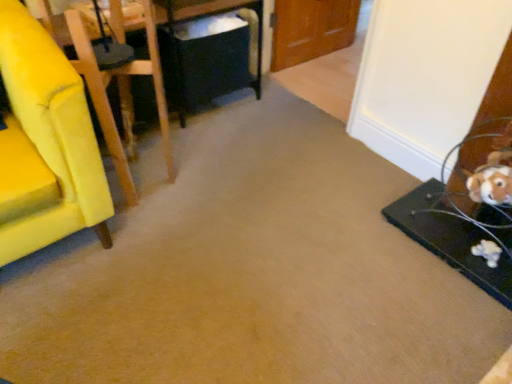
Question: From the image's perspective, would you say black plastic table at center, arranged as the first table when viewed from the back, is positioned over black matte table at right, the first table positioned from the bottom?

Choices:
 (A) yes
 (B) no

Answer: (A)

Question: Can you confirm if black plastic table at center, the second table when ordered from right to left, is bigger than black matte table at right, placed as the 2th table when sorted from left to right?

Choices:
 (A) yes
 (B) no

Answer: (A)

Question: Does black plastic table at center, which appears as the 1th table when viewed from the left, have a greater height compared to black matte table at right, arranged as the second table when viewed from the top?

Choices:
 (A) no
 (B) yes

Answer: (B)

Question: From a real-world perspective, is black plastic table at center, which ranks as the first table in top-to-bottom order, below black matte table at right, arranged as the second table when viewed from the top?

Choices:
 (A) yes
 (B) no

Answer: (B)

Question: From the image's perspective, is black plastic table at center, arranged as the first table when viewed from the back, located beneath black matte table at right, the first table positioned from the bottom?

Choices:
 (A) yes
 (B) no

Answer: (B)

Question: Considering the positions of point (101, 109) and point (473, 243), is point (101, 109) closer or farther from the camera than point (473, 243)?

Choices:
 (A) closer
 (B) farther

Answer: (A)

Question: In the image, is yellow fabric chair at left on the left side or the right side of black matte table at right, arranged as the second table when viewed from the top?

Choices:
 (A) right
 (B) left

Answer: (B)

Question: From the image's perspective, is yellow fabric chair at left located above or below black matte table at right, placed as the 2th table when sorted from left to right?

Choices:
 (A) below
 (B) above

Answer: (B)

Question: Is yellow fabric chair at left inside or outside of black matte table at right, arranged as the second table when viewed from the top?

Choices:
 (A) outside
 (B) inside

Answer: (A)

Question: Considering the positions of black matte table at right, which appears as the 1th table when viewed from the right, and yellow fabric chair at left in the image, is black matte table at right, which appears as the 1th table when viewed from the right, taller or shorter than yellow fabric chair at left?

Choices:
 (A) short
 (B) tall

Answer: (A)

Question: Is black matte table at right, arranged as the second table when viewed from the top, in front of or behind yellow fabric chair at left in the image?

Choices:
 (A) front
 (B) behind

Answer: (B)

Question: From a real-world perspective, relative to yellow fabric chair at left, is black matte table at right, marked as the first table in a front-to-back arrangement, vertically above or below?

Choices:
 (A) above
 (B) below

Answer: (B)

Question: From the image's perspective, relative to yellow fabric chair at left, is black matte table at right, marked as the first table in a front-to-back arrangement, above or below?

Choices:
 (A) above
 (B) below

Answer: (B)

Question: From a real-world perspective, is black matte table at right, marked as the first table in a front-to-back arrangement, positioned above or below black plastic table at center, the second table when ordered from right to left?

Choices:
 (A) below
 (B) above

Answer: (A)

Question: In terms of height, does black matte table at right, which appears as the 1th table when viewed from the right, look taller or shorter compared to black plastic table at center, which appears as the 1th table when viewed from the left?

Choices:
 (A) short
 (B) tall

Answer: (A)